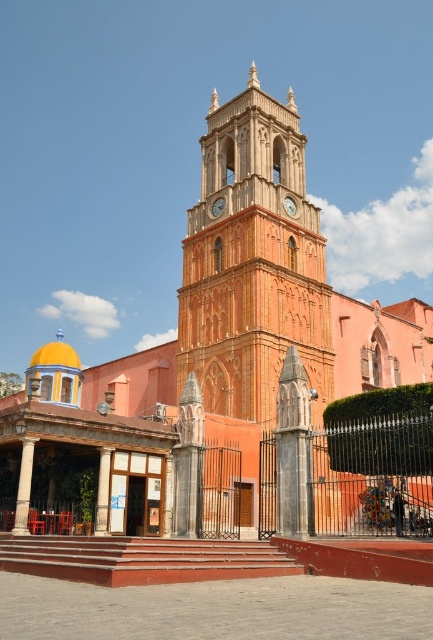
Is metallic gold clock at center positioned before metallic clock at center?

Yes, metallic gold clock at center is closer to the viewer.

Who is positioned more to the left, metallic gold clock at center or metallic clock at center?

metallic clock at center

Is point (296, 211) positioned behind point (212, 212)?

No, it is in front of (212, 212).

Find the location of a particular element. The width and height of the screenshot is (433, 640). metallic gold clock at center is located at coordinates (290, 205).

Is point (274, 168) closer to camera compared to point (223, 202)?

No, (274, 168) is further to viewer.

Is terracotta brick tower at center in front of metallic clock at center?

Yes, it is.

At what (x,y) coordinates should I click in order to perform the action: click on terracotta brick tower at center. Please return your answer as a coordinate pair (x, y). This screenshot has height=640, width=433. Looking at the image, I should click on (252, 262).

Can you confirm if terracotta brick tower at center is shorter than metallic gold clock at center?

No.

How far apart are terracotta brick tower at center and metallic gold clock at center?

terracotta brick tower at center and metallic gold clock at center are 11.67 meters apart.

Is point (307, 316) positioned in front of point (294, 202)?

Yes, it is.

Where is `terracotta brick tower at center`? terracotta brick tower at center is located at coordinates (252, 262).